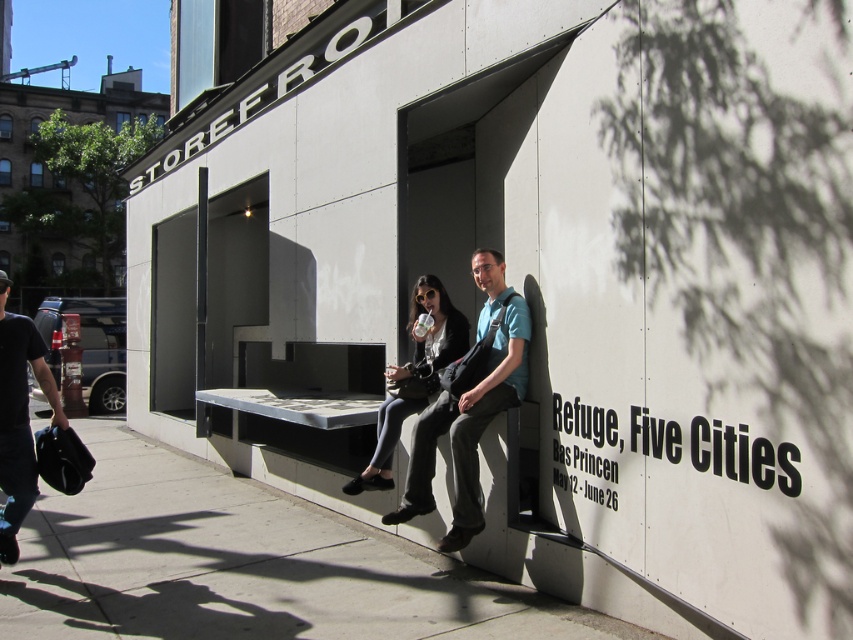
Locate an element on the screen. This screenshot has height=640, width=853. black leather bag at lower left is located at coordinates (18, 419).

From the picture: Is black leather bag at lower left wider than matte black jacket at center?

In fact, black leather bag at lower left might be narrower than matte black jacket at center.

Does point (7, 289) come closer to viewer compared to point (432, 388)?

That is True.

Where is `black leather bag at lower left`? The height and width of the screenshot is (640, 853). black leather bag at lower left is located at coordinates (18, 419).

Does gray concrete bench at lower center have a greater height compared to matte black jacket at center?

In fact, gray concrete bench at lower center may be shorter than matte black jacket at center.

Between gray concrete bench at lower center and matte black jacket at center, which one appears on the right side from the viewer's perspective?

Positioned to the right is matte black jacket at center.

Locate an element on the screen. gray concrete bench at lower center is located at coordinates (244, 564).

Where is `gray concrete bench at lower center`? Image resolution: width=853 pixels, height=640 pixels. gray concrete bench at lower center is located at coordinates (244, 564).

Between matte black bench at center and matte black jacket at center, which one is positioned higher?

matte black bench at center is higher up.

Consider the image. Can you confirm if matte black bench at center is positioned above matte black jacket at center?

Correct, matte black bench at center is located above matte black jacket at center.

Which is in front, point (485, 369) or point (355, 492)?

Point (485, 369) is in front.

The width and height of the screenshot is (853, 640). In order to click on matte black bench at center in this screenshot , I will do `click(469, 406)`.